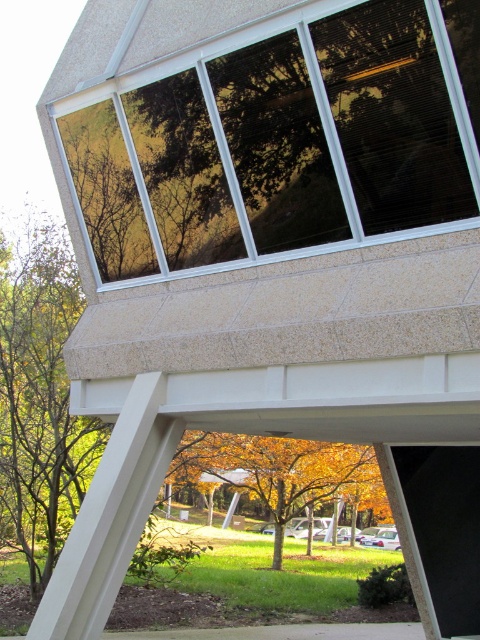
Question: Is clear glass window at upper center bigger than golden leafy tree at center?

Choices:
 (A) no
 (B) yes

Answer: (A)

Question: From the image, what is the correct spatial relationship of clear glass window at upper center in relation to golden leafy tree at center?

Choices:
 (A) above
 (B) below

Answer: (A)

Question: Which of the following is the farthest from the observer?

Choices:
 (A) clear glass window at upper center
 (B) golden leafy tree at center

Answer: (B)

Question: Is the position of clear glass window at upper center more distant than that of golden leafy tree at center?

Choices:
 (A) no
 (B) yes

Answer: (A)

Question: Among these points, which one is farthest from the camera?

Choices:
 (A) (371, 77)
 (B) (232, 448)

Answer: (B)